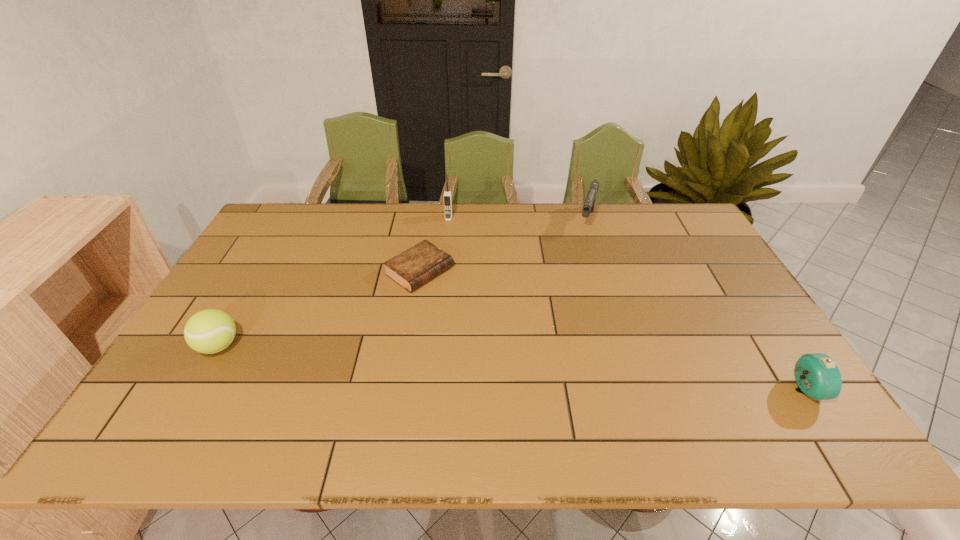
In order to click on free space between the diary and the cellular telephone in this screenshot , I will do `click(434, 245)`.

Locate an element on the screen. object that is the second closest one to the cellular telephone is located at coordinates (588, 206).

Image resolution: width=960 pixels, height=540 pixels. I want to click on object that stands as the third closest to the tallest object, so click(x=209, y=331).

Find the location of `vacant point that satisfies the following two spatial constraints: 1. on the front side of the shortest object; 2. on the front-facing side of the nearest object`. vacant point that satisfies the following two spatial constraints: 1. on the front side of the shortest object; 2. on the front-facing side of the nearest object is located at coordinates (401, 390).

The width and height of the screenshot is (960, 540). Identify the location of free space that satisfies the following two spatial constraints: 1. on the front side of the rightmost object; 2. on the front-facing side of the third nearest object. click(401, 390).